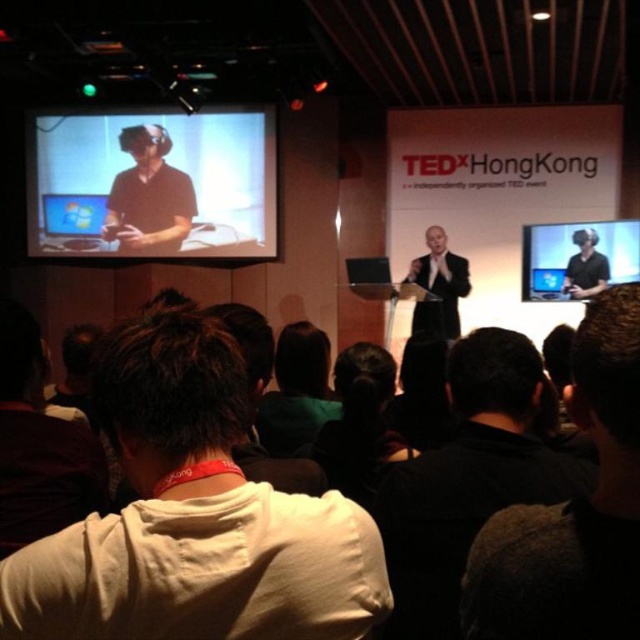
What are the coordinates of the matte black vr headset at upper left?

The coordinates of the matte black vr headset at upper left are at point (148, 195).

You are attending the TEDxHongKong event and want to take a photo of the speaker. You notice two points marked on the stage floor. The first point is at coordinate point (108, 163), and the second is at point (595, 292). Which point is closer to the stage front where the speaker is standing?

Point (108, 163) is behind point (595, 292). Since the speaker is at the front of the stage, the point closer to the front would be the one that is in front. Therefore, point (595, 292) is closer to the stage front where the speaker is standing.